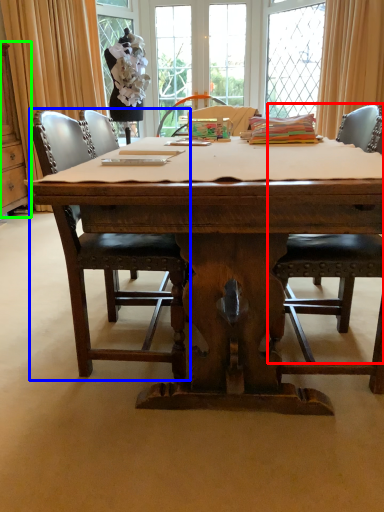
Question: Which object is positioned farthest from chair (highlighted by a red box)? Select from chair (highlighted by a blue box) and cabinetry (highlighted by a green box).

Choices:
 (A) chair
 (B) cabinetry

Answer: (B)